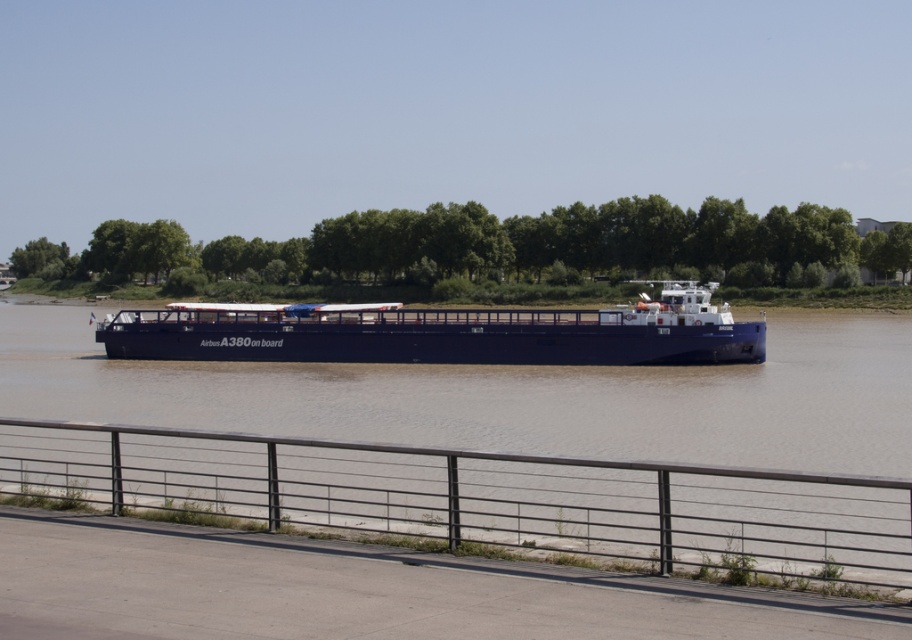
You are a photographer standing at the edge of the riverbank. You want to capture a photo of the metal fence at lower center and the blue matte cargo ship at center in the same frame. Which object will appear narrower in the photo?

The metal fence at lower center appears narrower in the photo because it is thinner than the blue matte cargo ship at center.

You are standing on the deck of the blue matte cargo ship at center and want to reach the metal fence at lower center. Given that the ship is 100 feet long, can you walk directly to the fence without leaving the ship?

The metal fence at lower center is 120.86 feet away from the blue matte cargo ship at center. Since the ship is only 100 feet long, the fence is beyond the ship, so you cannot walk directly to it without leaving the ship.

You are standing on the deck of the barge and want to reach the point marked at coordinates (751, 564). How far will you have to walk to get there?

The point at coordinates (751, 564) is 11.36 meters away from the camera, so you will have to walk 11.36 meters to reach it.